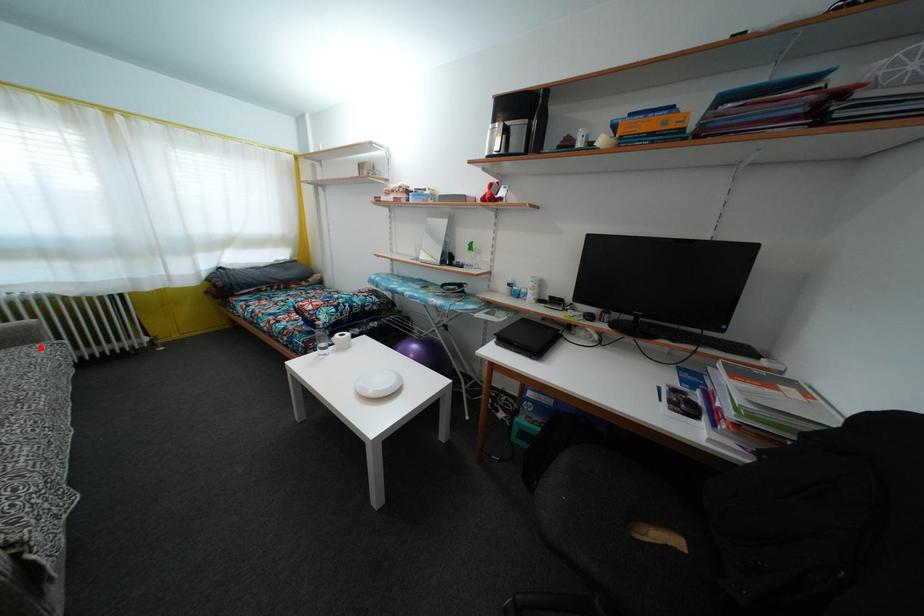
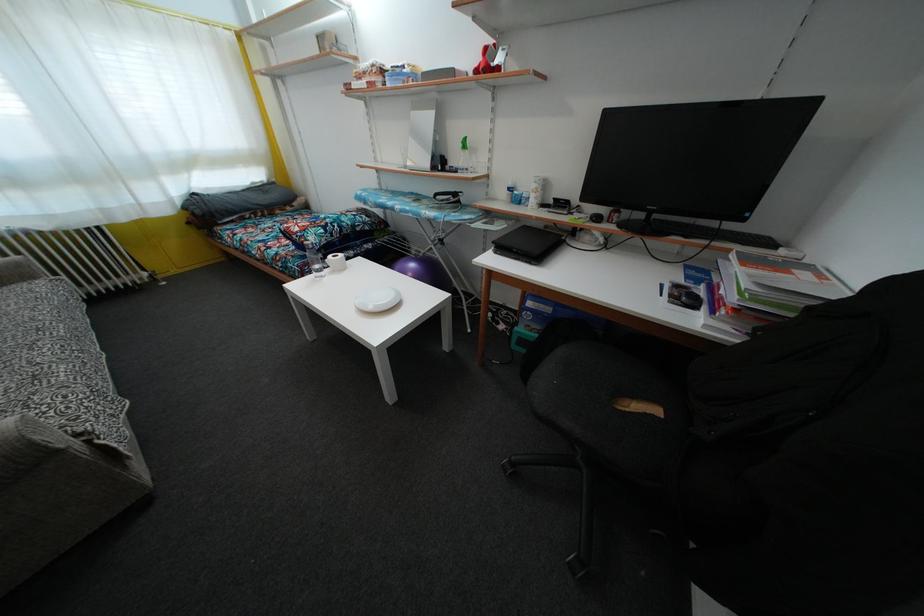
Question: I am providing you with two images of the same scene from different viewpoints. Image1 has a red point marked. In image2, the corresponding 3D location appears at what relative position? Reply with the corresponding letter.

Choices:
 (A) Closer
 (B) Farther

Answer: (B)